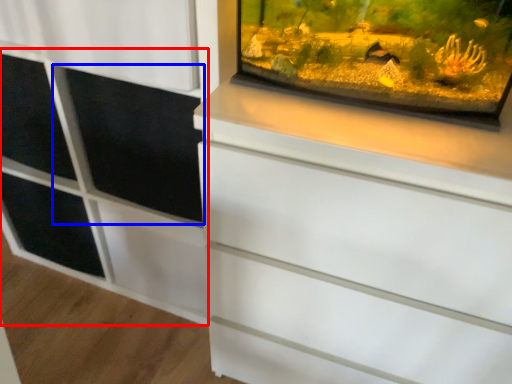
Question: Which of the following is the closest to the observer, side cabinet (highlighted by a red box) or screen door (highlighted by a blue box)?

Choices:
 (A) side cabinet
 (B) screen door

Answer: (A)